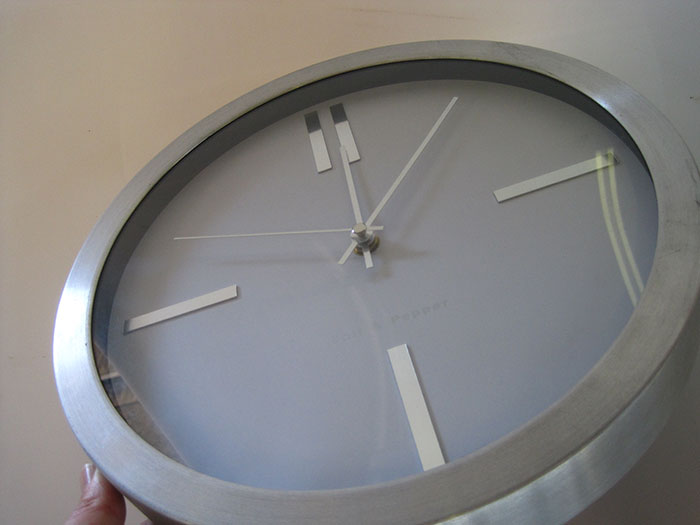
Identify the location of circular edge of clock. This screenshot has width=700, height=525. coord(85,370), coord(580,78), coord(439,493), coord(236,105).